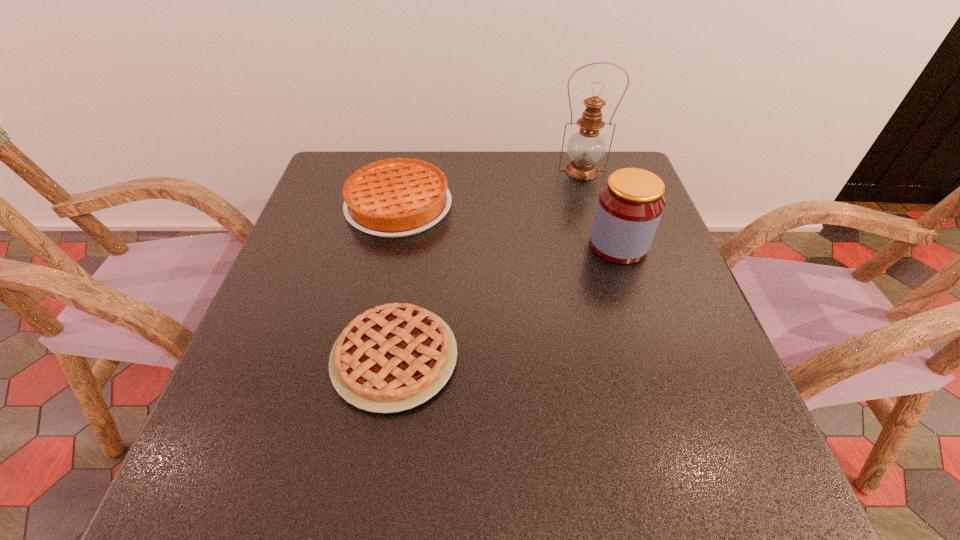
At what (x,y) coordinates should I click in order to perform the action: click on vacant space that is in between the nearest object and the tallest object. Please return your answer as a coordinate pair (x, y). The height and width of the screenshot is (540, 960). Looking at the image, I should click on (489, 264).

Where is `free space between the shorter pie and the tallest object`? Image resolution: width=960 pixels, height=540 pixels. free space between the shorter pie and the tallest object is located at coordinates (489, 264).

Identify which object is the third closest to the oil lamp. Please provide its 2D coordinates. Your answer should be formatted as a tuple, i.e. [(x, y)], where the tuple contains the x and y coordinates of a point satisfying the conditions above.

[(391, 358)]

Identify which object is the third closest to the third shortest object. Please provide its 2D coordinates. Your answer should be formatted as a tuple, i.e. [(x, y)], where the tuple contains the x and y coordinates of a point satisfying the conditions above.

[(391, 198)]

Image resolution: width=960 pixels, height=540 pixels. In order to click on blank space that satisfies the following two spatial constraints: 1. on the back side of the tallest object; 2. on the left side of the shorter pie in this screenshot , I will do `click(424, 170)`.